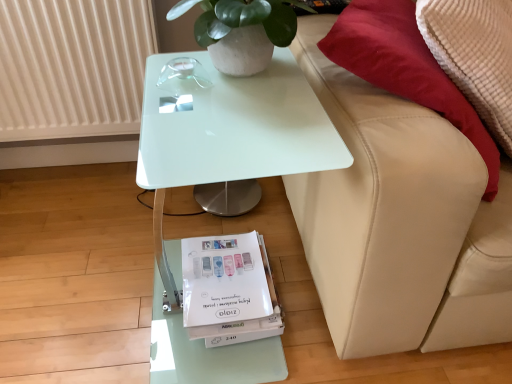
Question: Is white matte pot at upper center in front of white glossy table at center?

Choices:
 (A) no
 (B) yes

Answer: (A)

Question: From the image's perspective, is white matte pot at upper center over white glossy table at center?

Choices:
 (A) yes
 (B) no

Answer: (A)

Question: Is white matte pot at upper center bigger than white glossy table at center?

Choices:
 (A) no
 (B) yes

Answer: (A)

Question: Does white matte pot at upper center turn towards white glossy table at center?

Choices:
 (A) no
 (B) yes

Answer: (A)

Question: Can you confirm if white matte pot at upper center is wider than white glossy table at center?

Choices:
 (A) yes
 (B) no

Answer: (B)

Question: Considering the relative sizes of white matte pot at upper center and white glossy table at center in the image provided, is white matte pot at upper center smaller than white glossy table at center?

Choices:
 (A) no
 (B) yes

Answer: (B)

Question: Does white matte pot at upper center lie in front of white paper magazine at lower center?

Choices:
 (A) yes
 (B) no

Answer: (A)

Question: Is white matte pot at upper center to the right of white paper magazine at lower center from the viewer's perspective?

Choices:
 (A) no
 (B) yes

Answer: (B)

Question: Does white matte pot at upper center have a lesser height compared to white paper magazine at lower center?

Choices:
 (A) yes
 (B) no

Answer: (B)

Question: Could white paper magazine at lower center be considered to be inside white matte pot at upper center?

Choices:
 (A) no
 (B) yes

Answer: (A)

Question: Is white matte pot at upper center directly adjacent to white paper magazine at lower center?

Choices:
 (A) yes
 (B) no

Answer: (B)

Question: Is white matte pot at upper center far from white paper magazine at lower center?

Choices:
 (A) no
 (B) yes

Answer: (A)

Question: Would you say white glossy table at center is outside beige leather couch at right?

Choices:
 (A) no
 (B) yes

Answer: (B)